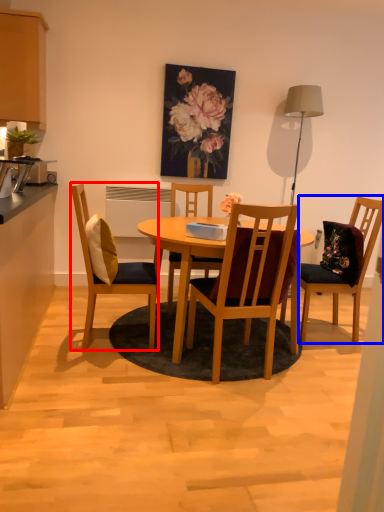
Question: Which object is closer to the camera taking this photo, chair (highlighted by a red box) or chair (highlighted by a blue box)?

Choices:
 (A) chair
 (B) chair

Answer: (A)